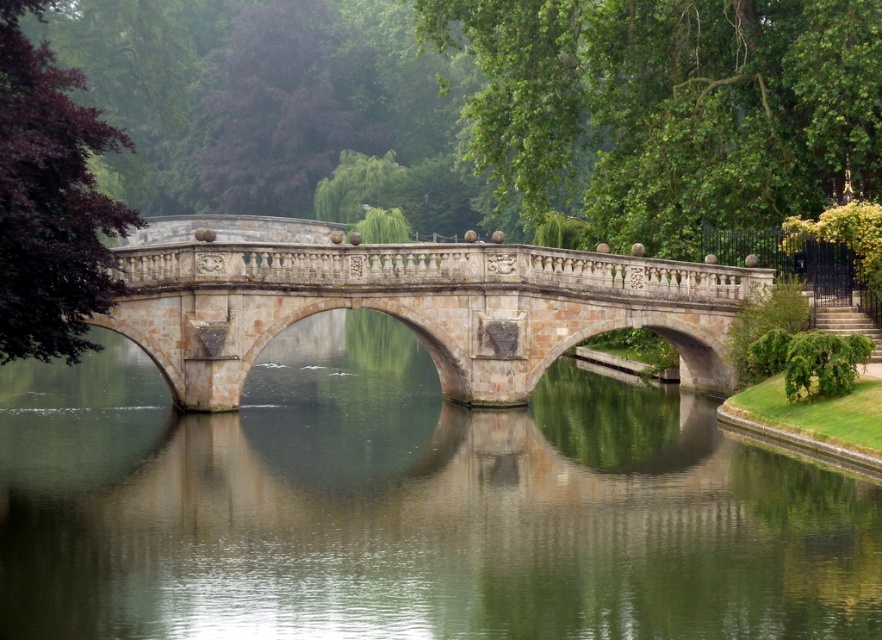
You are standing on the stone bridge at center and want to look down to see the smooth stone water at center. In which direction should you look relative to the bridge?

You should look to the right side of the stone bridge at center because the smooth stone water at center is positioned on the right side of it.

You are standing on the stone bridge and want to walk towards the point that is closer to you. Which point should you walk towards, point (735,634) or point (567,280)?

You should walk towards point (735,634) because it is in front of point (567,280), meaning it is closer to your current position on the bridge.

You are an architect designing a new pathway. You need to decide whether to place a bench on the smooth stone water at center or the stone bridge at center. Which location is wider and more suitable for a bench?

The stone bridge at center has a greater width than the smooth stone water at center, making it the more suitable location for placing a bench.